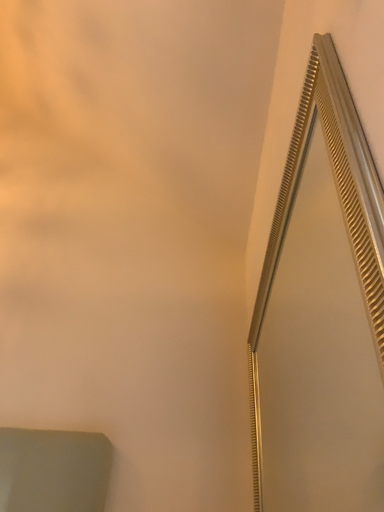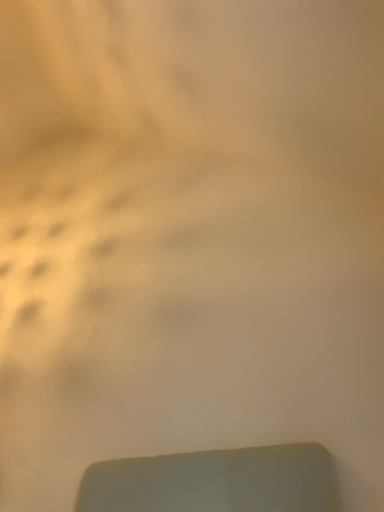
Question: How did the camera likely rotate when shooting the video?

Choices:
 (A) rotated left
 (B) rotated right

Answer: (A)